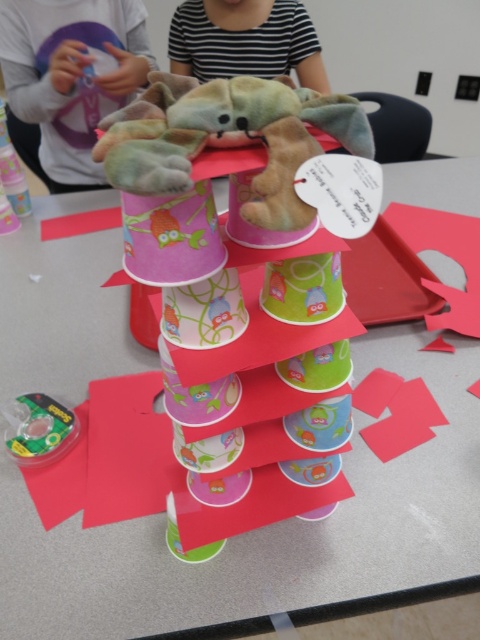
Question: Which point appears farthest from the camera in this image?

Choices:
 (A) (274, 84)
 (B) (119, 12)

Answer: (B)

Question: Which object appears closest to the camera in this image?

Choices:
 (A) soft plush toy at center
 (B) fluffy plush toy at center

Answer: (B)

Question: Can you confirm if soft plush toy at center is positioned above striped fabric stuffed animal at upper center?

Choices:
 (A) no
 (B) yes

Answer: (A)

Question: Which of the following is the closest to the observer?

Choices:
 (A) soft plush toy at center
 (B) green plastic toy at lower left
 (C) soft plush toy at upper center

Answer: (A)

Question: Can you confirm if striped fabric stuffed animal at upper center is positioned above green plastic toy at lower left?

Choices:
 (A) yes
 (B) no

Answer: (A)

Question: Considering the relative positions of soft plush toy at upper center and green plastic toy at lower left in the image provided, where is soft plush toy at upper center located with respect to green plastic toy at lower left?

Choices:
 (A) right
 (B) left

Answer: (B)